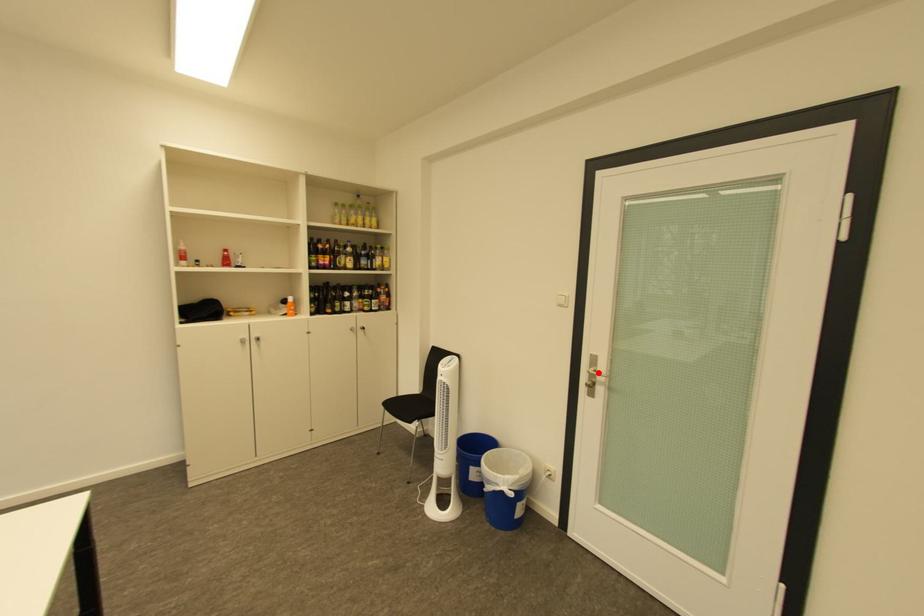
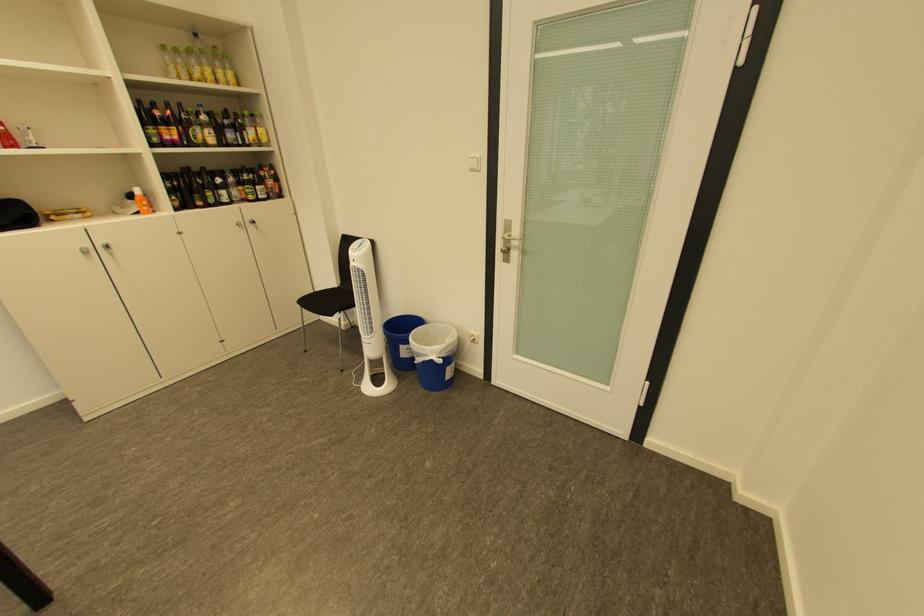
Where in the second image is the point corresponding to the highlighted location from the first image?

(513, 238)